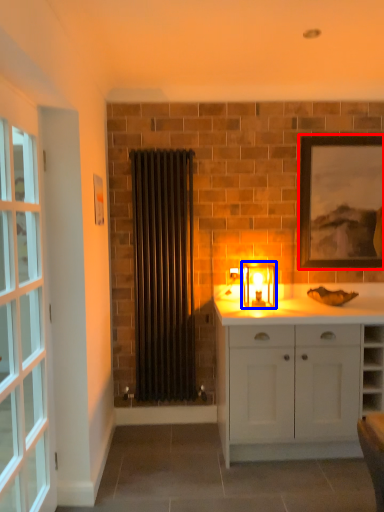
Question: Which point is further to the camera, picture frame (highlighted by a red box) or candle holder (highlighted by a blue box)?

Choices:
 (A) picture frame
 (B) candle holder

Answer: (A)